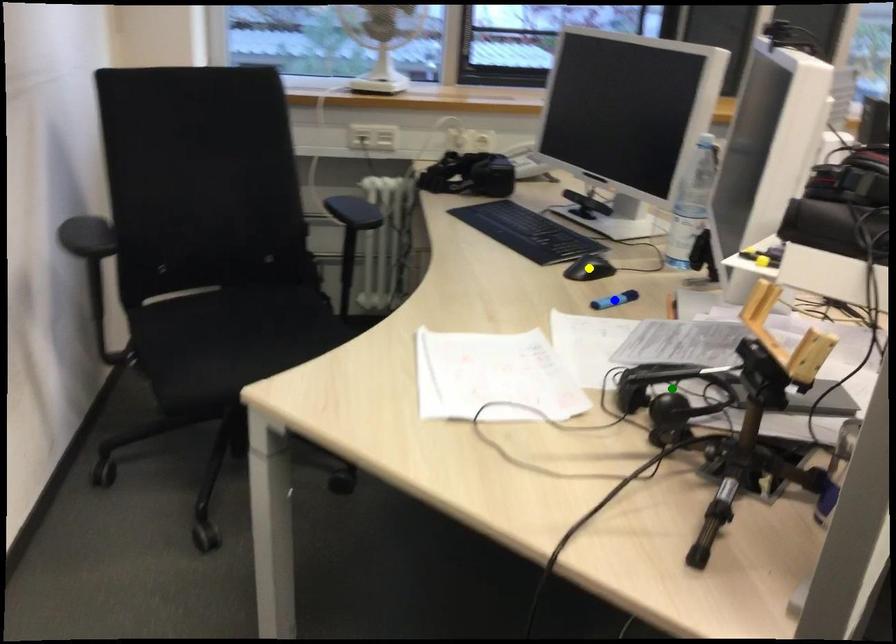
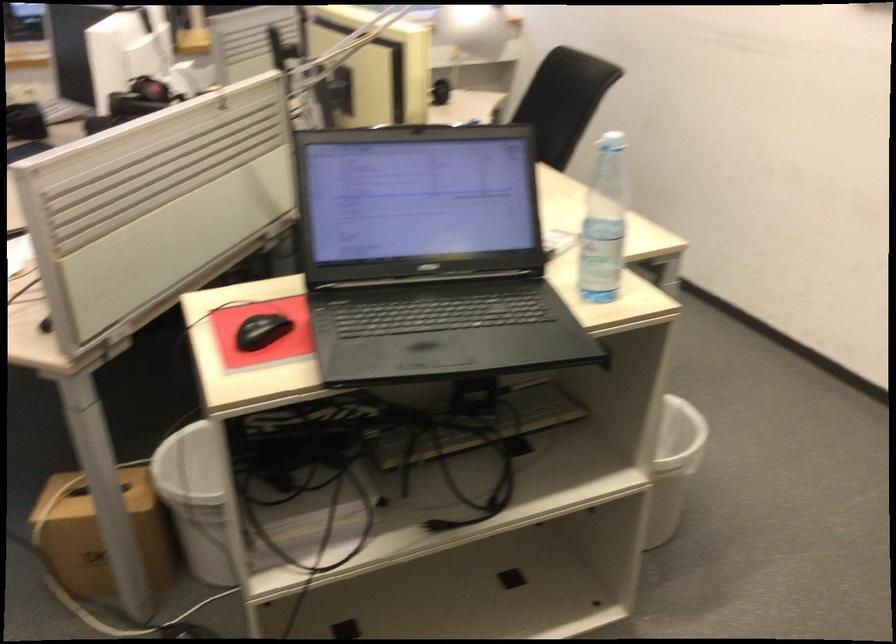
I am providing you with two images of the same scene from different viewpoints. Three points are marked in image1. Which point corresponds to a part or object that is occluded in image2?In image1, three points are marked. Which of them correspond to a part or object that is occluded in image2?Among the three points shown in image1, which one corresponds to a part or object that is no longer visible due to occlusion in image2?

blue point, green point, yellow point cannot be seen in image2.